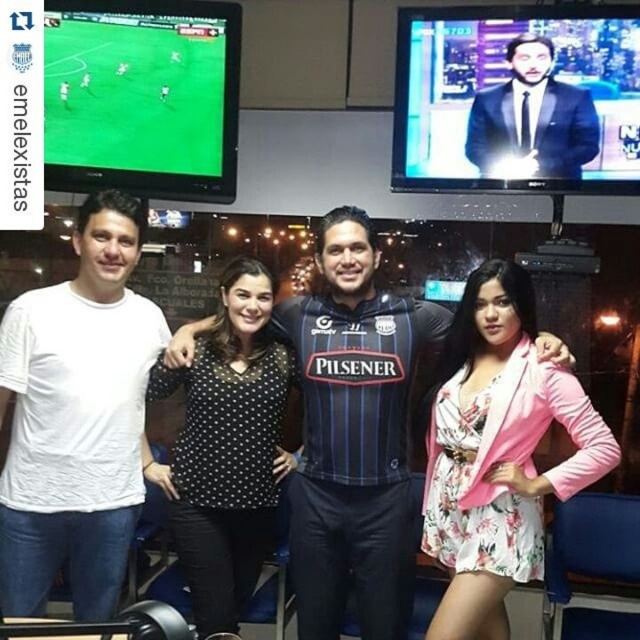
Between white cotton t-shirt at left and dark blue suit at upper right, which one has less height?

Standing shorter between the two is dark blue suit at upper right.

Is point (42, 492) more distant than point (532, 173)?

No, it is in front of (532, 173).

Between point (88, 324) and point (563, 136), which one is positioned in front?

Point (88, 324) is in front.

The width and height of the screenshot is (640, 640). I want to click on white cotton t-shirt at left, so click(76, 419).

Between white cotton t-shirt at left and blue striped jersey at center, which one is positioned lower?

blue striped jersey at center is lower down.

Between point (74, 380) and point (438, 339), which one is positioned behind?

Point (438, 339)

This screenshot has width=640, height=640. I want to click on white cotton t-shirt at left, so click(76, 419).

Consider the image. Who is more distant from viewer, (353, 564) or (515, 456)?

Point (353, 564)

Which is more to the right, blue striped jersey at center or floral fabric romper at center?

Positioned to the right is floral fabric romper at center.

Who is more forward, (364, 220) or (481, 424)?

Positioned in front is point (481, 424).

The height and width of the screenshot is (640, 640). Find the location of `blue striped jersey at center`. blue striped jersey at center is located at coordinates (353, 433).